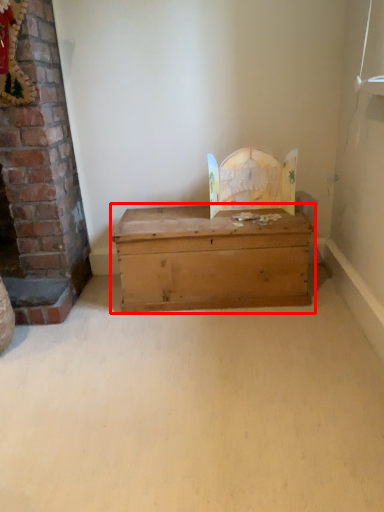
Question: From the image's perspective, what is the correct spatial relationship of table (annotated by the red box) in relation to fireplace?

Choices:
 (A) above
 (B) below

Answer: (B)